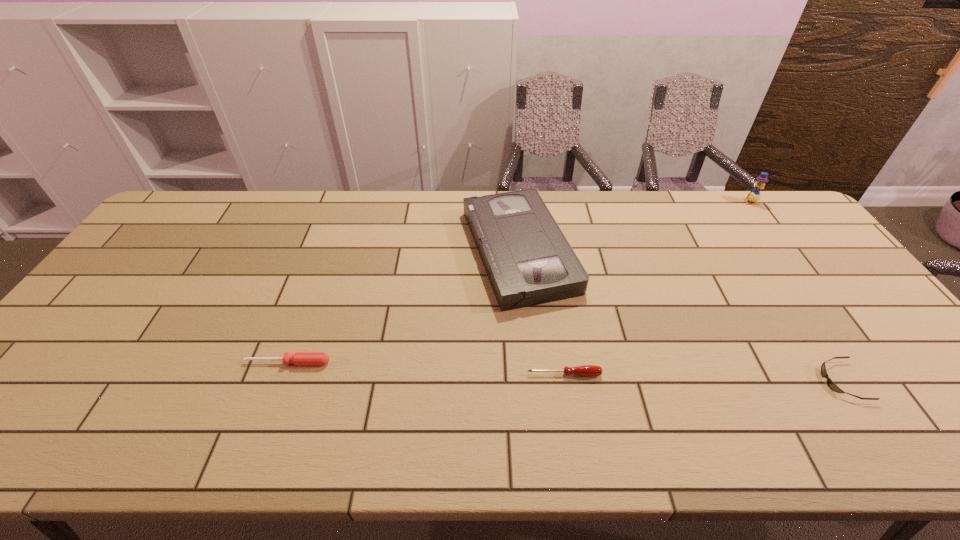
Find the location of a particular element. vacant space at the far edge of the desktop is located at coordinates (258, 203).

In the image, there is a desktop. At what (x,y) coordinates should I click in order to perform the action: click on vacant space at the near edge. Please return your answer as a coordinate pair (x, y). Looking at the image, I should click on (494, 446).

Find the location of a particular element. This screenshot has height=540, width=960. vacant space at the left edge of the desktop is located at coordinates (36, 414).

Where is `vacant region at the right edge of the desktop`? vacant region at the right edge of the desktop is located at coordinates (876, 334).

Locate an element on the screen. The height and width of the screenshot is (540, 960). vacant position at the far left corner of the desktop is located at coordinates (177, 225).

Where is `free space between the duckling and the fourth shortest object`? free space between the duckling and the fourth shortest object is located at coordinates (635, 226).

The width and height of the screenshot is (960, 540). Identify the location of free spot between the nearer screwdriver and the sunglasses. (703, 377).

I want to click on free area in between the rightmost object and the sunglasses, so click(796, 292).

At what (x,y) coordinates should I click in order to perform the action: click on vacant space that's between the right screwdriver and the left screwdriver. Please return your answer as a coordinate pair (x, y). The image size is (960, 540). Looking at the image, I should click on coord(426,368).

Locate an element on the screen. free point between the rightmost object and the videotape is located at coordinates (635, 226).